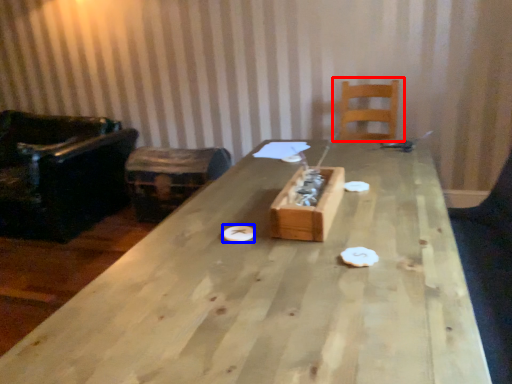
Question: Which object is further to the camera taking this photo, chair (highlighted by a red box) or paper plate (highlighted by a blue box)?

Choices:
 (A) chair
 (B) paper plate

Answer: (A)